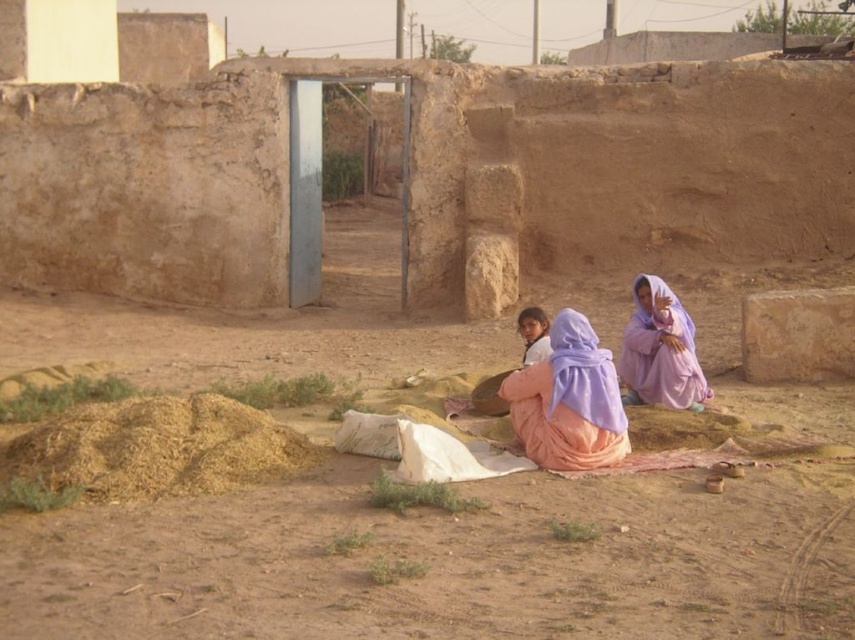
You are a tailor in this village and need to determine which purple fabric piece is better suited for making a large scarf. Based on the image, which one between the purple fabric child at center and the purple fabric at right has a greater width?

The purple fabric child at center has a greater width than the purple fabric at right, making it more suitable for a large scarf.

In the rural village scene, there are two purple fabric items. The first is a purple fabric child at center, and the second is a purple fabric at right. Which one is taller?

The purple fabric child at center is taller than the purple fabric at right.